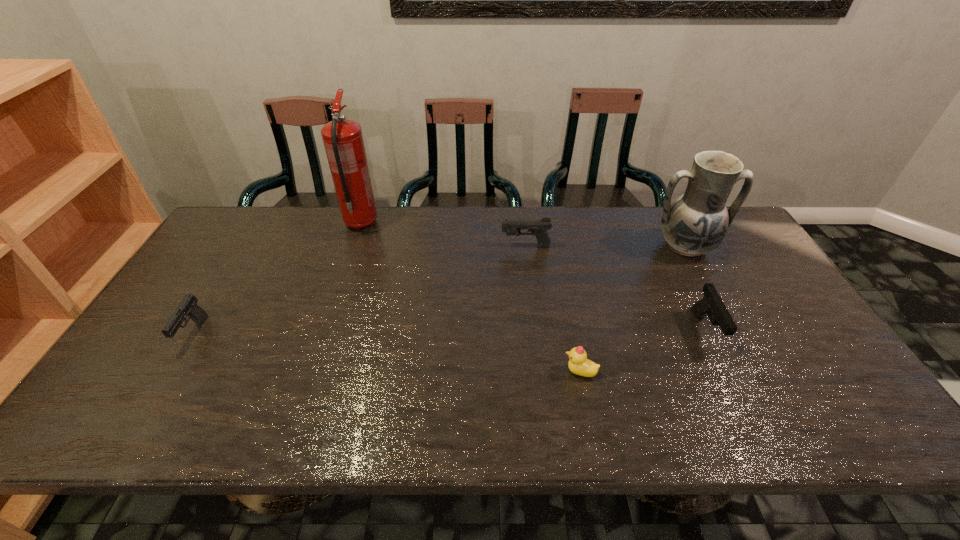
At what (x,y) coordinates should I click in order to perform the action: click on object present at the left edge. Please return your answer as a coordinate pair (x, y). The width and height of the screenshot is (960, 540). Looking at the image, I should click on (188, 306).

Identify the location of object present at the right edge. The width and height of the screenshot is (960, 540). (696, 223).

The width and height of the screenshot is (960, 540). I want to click on object that is at the far right corner, so [696, 223].

This screenshot has width=960, height=540. Find the location of `free space at the far edge of the desktop`. free space at the far edge of the desktop is located at coordinates (487, 219).

The image size is (960, 540). In order to click on free space at the near edge of the desktop in this screenshot , I will do `click(541, 437)`.

Where is `vacant space at the left edge of the desktop`? vacant space at the left edge of the desktop is located at coordinates (152, 374).

Identify the location of free space at the right edge of the desktop. (753, 310).

In the image, there is a desktop. Identify the location of blank space at the far left corner. (240, 210).

Find the location of `free space at the near left corner`. free space at the near left corner is located at coordinates (109, 408).

The height and width of the screenshot is (540, 960). Find the location of `vacant space that's between the duckling and the second object from left to right`. vacant space that's between the duckling and the second object from left to right is located at coordinates (470, 298).